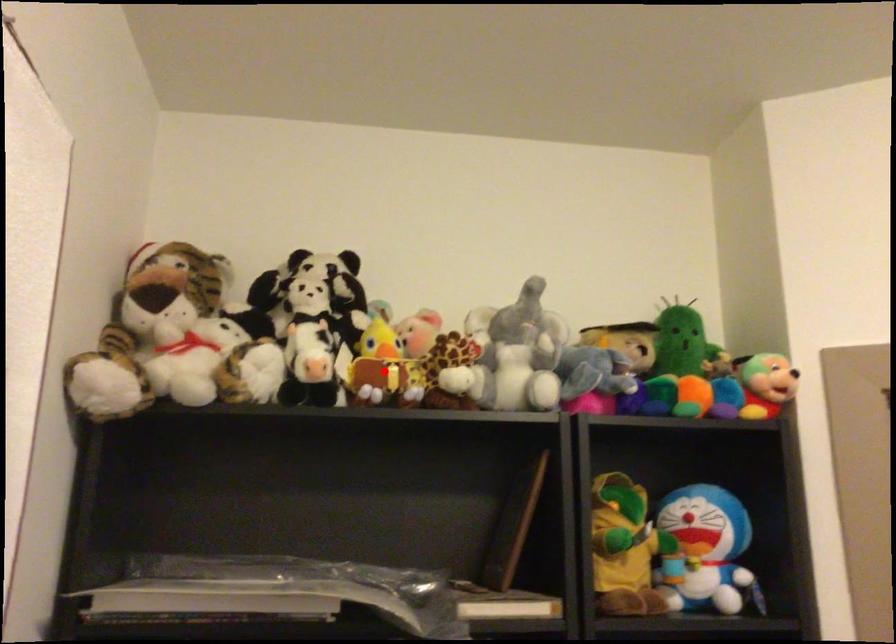
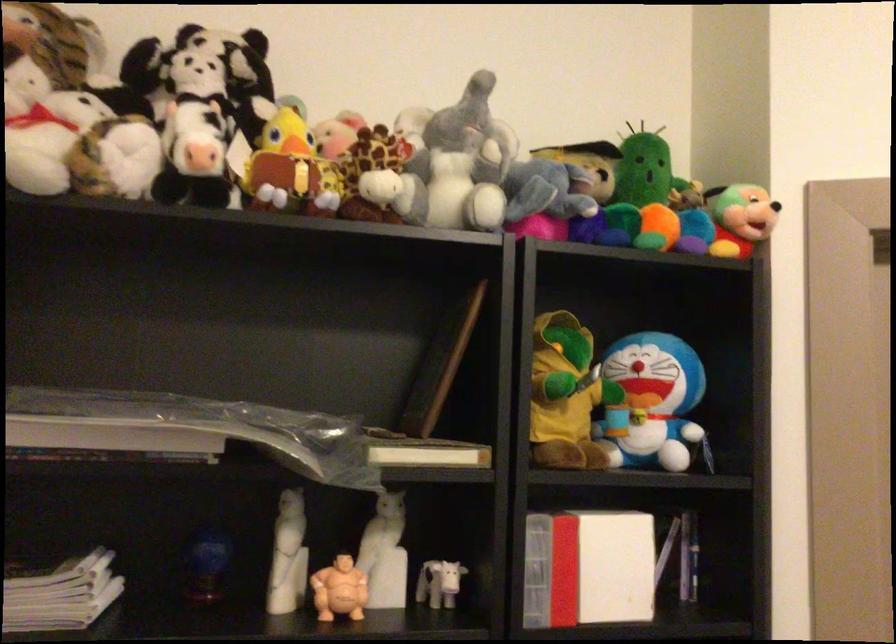
Question: I am providing you with two images of the same scene from different viewpoints. A red point is shown in image1. For the corresponding object point in image2, is it positioned nearer or farther from the camera?

Choices:
 (A) Nearer
 (B) Farther

Answer: (A)